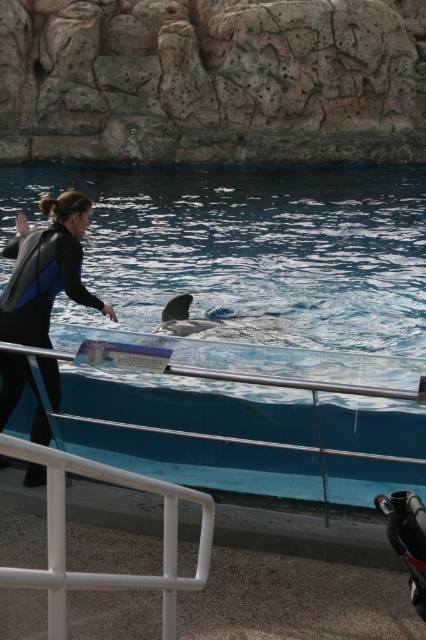
You are a marine biologist observing the dolphin in the tank. You notice two points marked in the image. The first point is at coordinates point (9, 332) and the second is at point (175, 330). From your observation position, which point is closer to you?

Point (9, 332) is in front of point (175, 330), so it is closer to you.